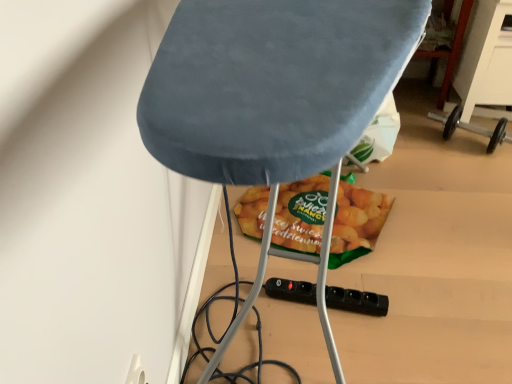
Identify the location of vacant area that is in front of green matte snack at center. (353, 317).